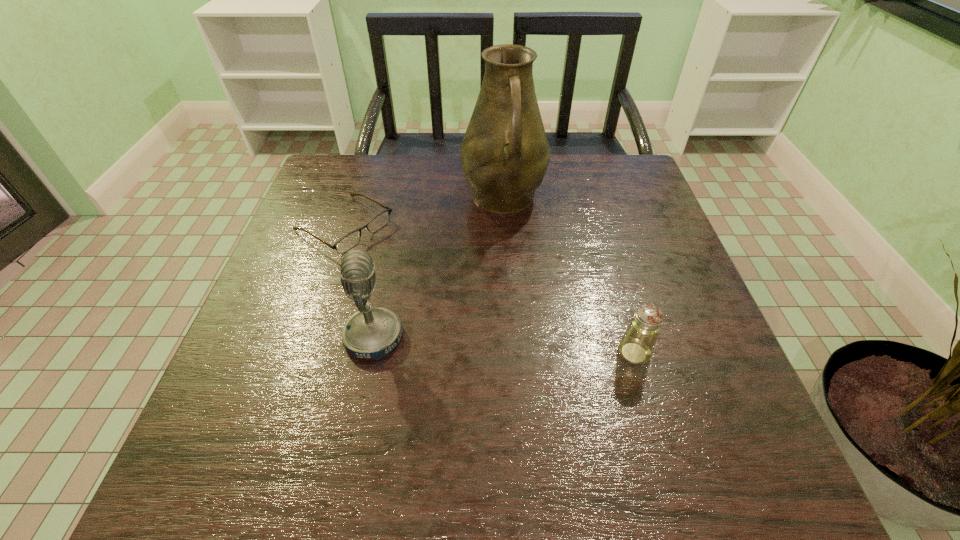
Image resolution: width=960 pixels, height=540 pixels. I want to click on the second tallest object, so click(x=373, y=332).

Where is `saltshaker`? saltshaker is located at coordinates (636, 346).

In order to click on the rightmost object in this screenshot , I will do `click(636, 346)`.

The width and height of the screenshot is (960, 540). What are the coordinates of `pitcher` in the screenshot? It's located at (505, 153).

The width and height of the screenshot is (960, 540). Find the location of `the tallest object`. the tallest object is located at coordinates (505, 153).

The image size is (960, 540). Find the location of `spectacles`. spectacles is located at coordinates (347, 242).

Where is `free space located on the front-facing side of the microphone`? The width and height of the screenshot is (960, 540). free space located on the front-facing side of the microphone is located at coordinates (434, 338).

Locate an element on the screen. The width and height of the screenshot is (960, 540). vacant space located on the right of the rightmost object is located at coordinates coord(681,353).

Image resolution: width=960 pixels, height=540 pixels. I want to click on vacant space located 0.290m on the handle side of the tallest object, so click(x=529, y=320).

The height and width of the screenshot is (540, 960). What are the coordinates of `vacant region located 0.090m on the handle side of the tallest object` in the screenshot? It's located at (515, 254).